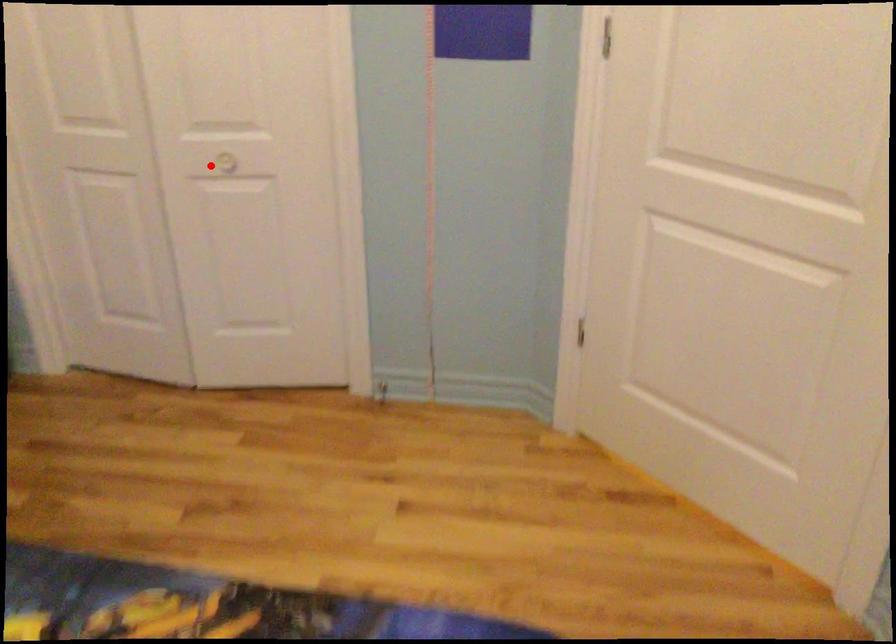
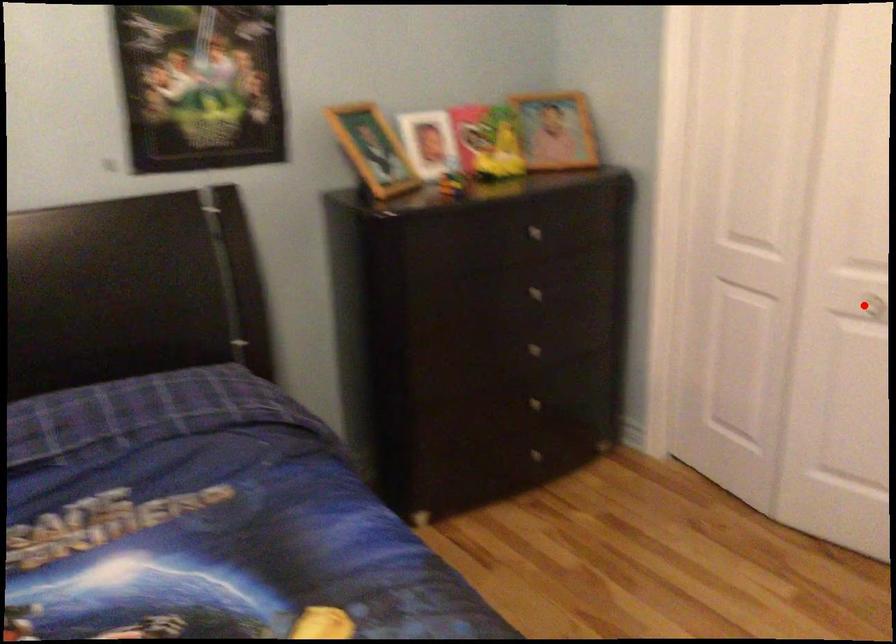
I am providing you with two images of the same scene from different viewpoints. A red point is marked on the first image and another point is marked on the second image. Do the highlighted points in image1 and image2 indicate the same real-world spot?

Yes